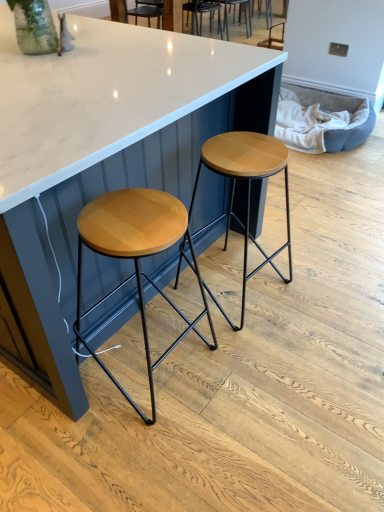
Find the location of a particular element. The image size is (384, 512). vacant point to the right of wooden matte stool at center, the first stool viewed from the right is located at coordinates (316, 291).